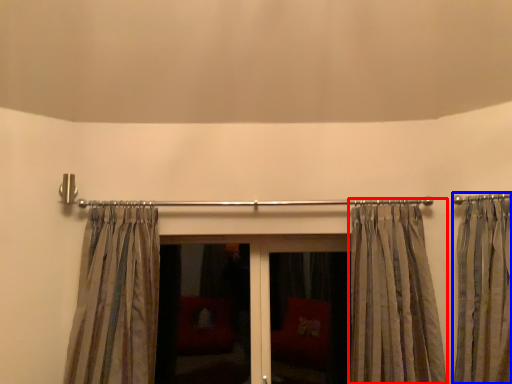
Question: Which object appears farthest to the camera in this image, curtain (highlighted by a red box) or curtain (highlighted by a blue box)?

Choices:
 (A) curtain
 (B) curtain

Answer: (A)